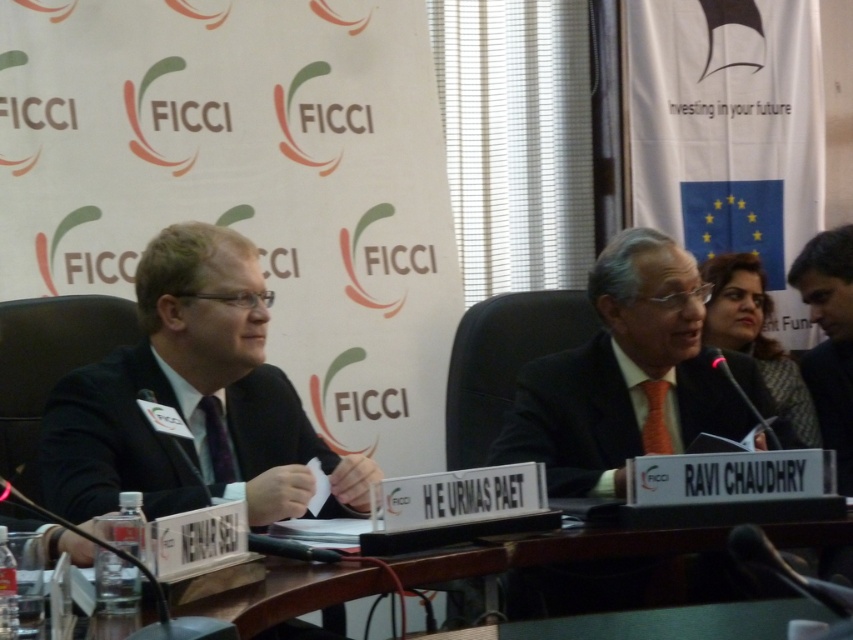
Question: Can you confirm if black plastic table at lower center is positioned to the left of dark gray suit at right?

Choices:
 (A) no
 (B) yes

Answer: (B)

Question: Can you confirm if black plastic table at lower center is thinner than dark gray suit at right?

Choices:
 (A) yes
 (B) no

Answer: (B)

Question: Which object is positioned farthest from the black plastic table at lower center?

Choices:
 (A) dark gray suit at right
 (B) orange silk tie at center

Answer: (A)

Question: Does orange silk tie at center appear under black plastic table at lower center?

Choices:
 (A) yes
 (B) no

Answer: (B)

Question: Which point is closer to the camera taking this photo?

Choices:
 (A) (508, 413)
 (B) (721, 308)
 (C) (379, 572)

Answer: (C)

Question: Which object appears closest to the camera in this image?

Choices:
 (A) black plastic table at lower center
 (B) orange silk tie at center

Answer: (A)